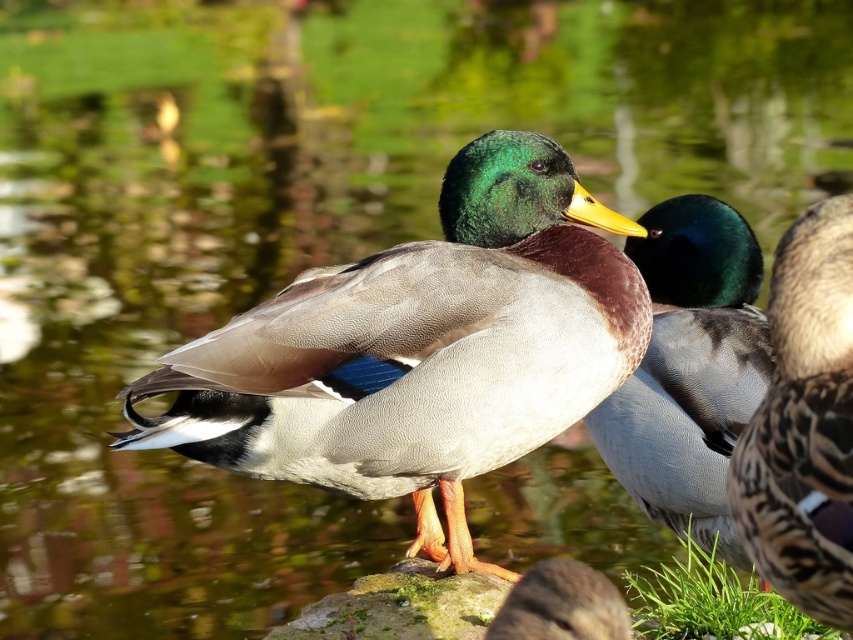
Which is below, brown speckled feathers at center or green leafy grass at lower right?

green leafy grass at lower right is below.

Which is behind, point (809, 544) or point (643, 625)?

Positioned behind is point (643, 625).

You are a GUI agent. You are given a task and a screenshot of the screen. Output one action in this format:
    pyautogui.click(x=<x>, y=<y>)
    Task: Click on the brown speckled feathers at center
    Image resolution: width=853 pixels, height=640 pixels.
    Given the screenshot: What is the action you would take?
    [x=804, y=422]

Who is more forward, (637, 264) or (744, 596)?

Point (744, 596)

Image resolution: width=853 pixels, height=640 pixels. I want to click on green glossy duck at center, so click(689, 369).

Is green leafy grass at lower right thinner than brown speckled feathers at lower center?

No.

Does green leafy grass at lower right appear on the left side of brown speckled feathers at lower center?

Incorrect, green leafy grass at lower right is not on the left side of brown speckled feathers at lower center.

Does point (697, 582) come farther from viewer compared to point (581, 588)?

Yes, point (697, 582) is behind point (581, 588).

This screenshot has width=853, height=640. What are the coordinates of `green leafy grass at lower right` in the screenshot? It's located at (712, 602).